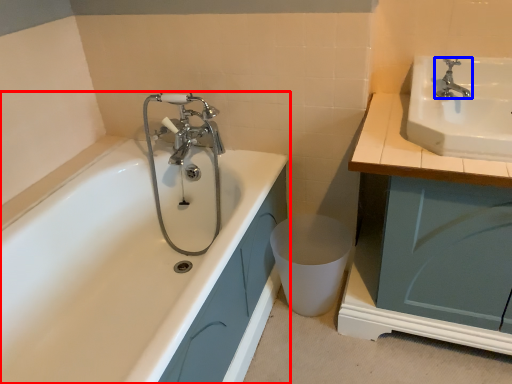
Question: Which object appears closest to the camera in this image, bathtub (highlighted by a red box) or tap (highlighted by a blue box)?

Choices:
 (A) bathtub
 (B) tap

Answer: (A)